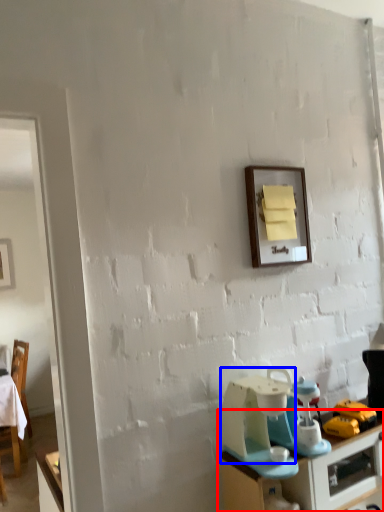
Question: Which object appears closest to the camera in this image, desk (highlighted by a red box) or appliance (highlighted by a blue box)?

Choices:
 (A) desk
 (B) appliance

Answer: (A)